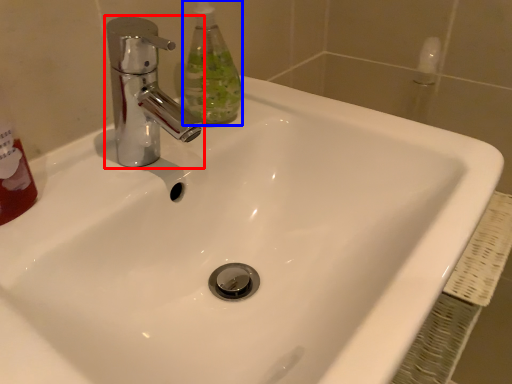
Question: Which of the following is the farthest to the observer, tap (highlighted by a red box) or cleaning product (highlighted by a blue box)?

Choices:
 (A) tap
 (B) cleaning product

Answer: (B)